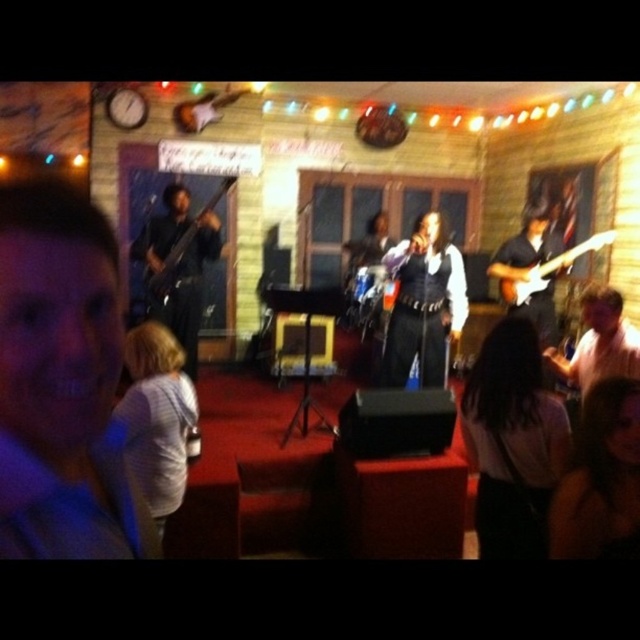
Can you confirm if glossy wood electric guitar at right is thinner than matte black bass at left?

In fact, glossy wood electric guitar at right might be wider than matte black bass at left.

Does glossy wood electric guitar at right come behind matte black bass at left?

No, glossy wood electric guitar at right is in front of matte black bass at left.

Which is in front, point (534, 284) or point (196, 212)?

Point (534, 284) is more forward.

Image resolution: width=640 pixels, height=640 pixels. I want to click on glossy wood electric guitar at right, so click(x=548, y=269).

Which is behind, point (563, 268) or point (573, 256)?

Point (563, 268)

Does white glossy electric guitar at right have a lesser height compared to glossy wood electric guitar at right?

No.

What do you see at coordinates (525, 250) in the screenshot?
I see `white glossy electric guitar at right` at bounding box center [525, 250].

Find the location of `white glossy electric guitar at right`. white glossy electric guitar at right is located at coordinates (525, 250).

Is white glossy electric guitar at right to the left of matte black bass at left from the viewer's perspective?

In fact, white glossy electric guitar at right is to the right of matte black bass at left.

Is point (518, 308) more distant than point (193, 221)?

Yes, it is.

Identify the location of white glossy electric guitar at right. (525, 250).